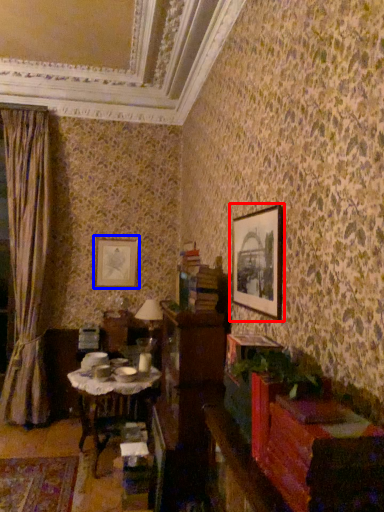
Question: Which point is further to the camera, picture frame (highlighted by a red box) or picture frame (highlighted by a blue box)?

Choices:
 (A) picture frame
 (B) picture frame

Answer: (B)